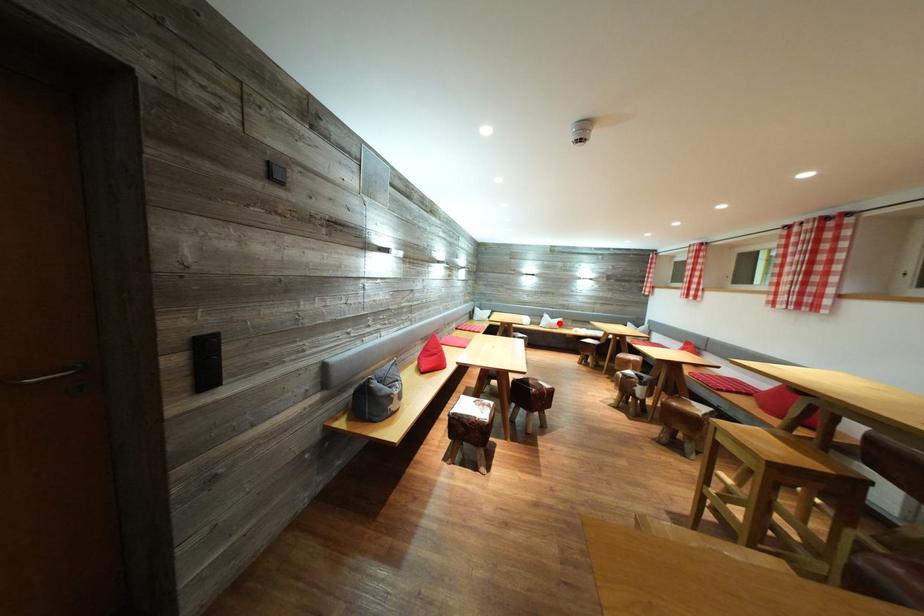
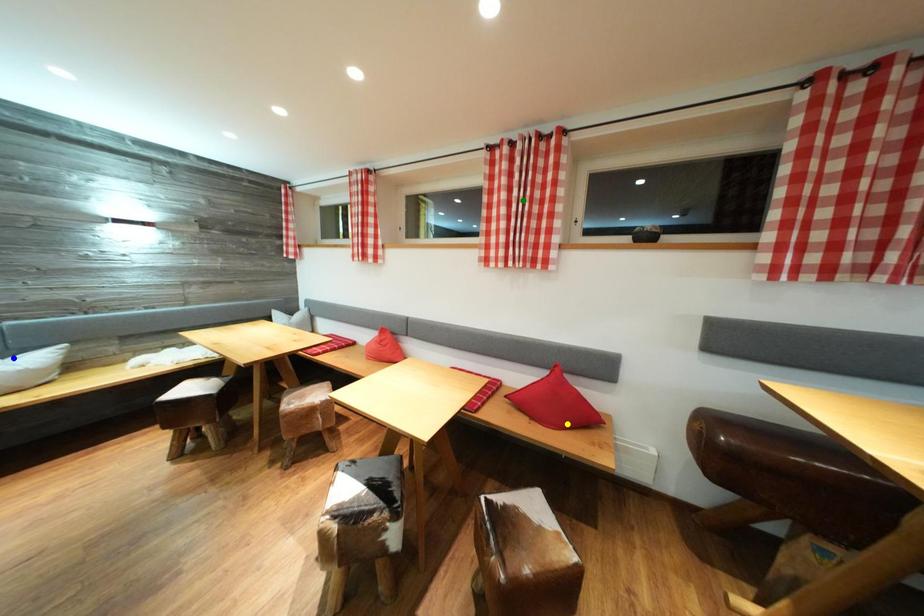
Question: I am providing you with two images of the same scene from different viewpoints. A red point is marked on the first image. You are given multiple points on the second image. In image 2, which mark is for the same physical point as the one in image 1?

Choices:
 (A) yellow point
 (B) blue point
 (C) green point

Answer: (B)